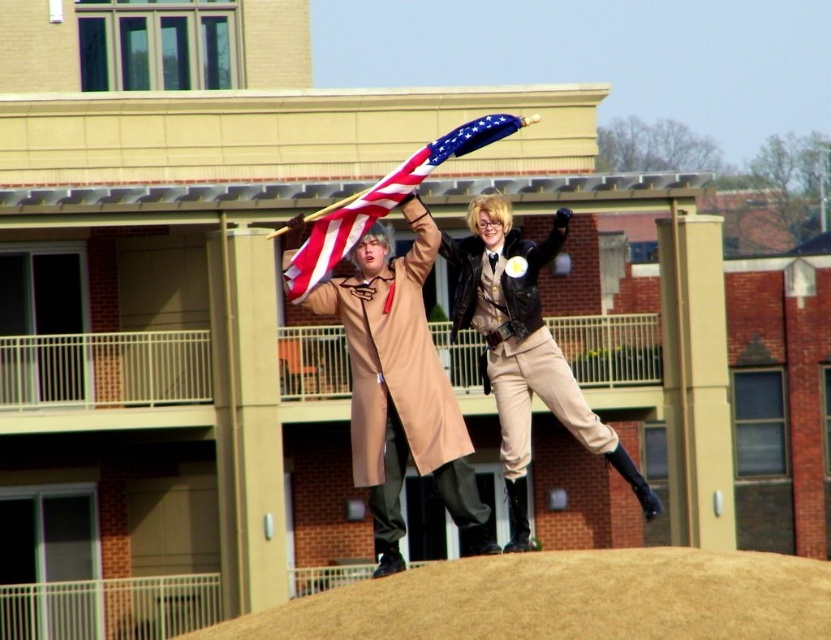
From the picture: You are a photographer positioned at the base of the building. You want to capture a shot where the american flag at center is clearly visible above the brown textured mound at lower center. Based on their positions, is this possible?

The brown textured mound at lower center is located below the american flag at center, so yes, the photographer can capture the american flag at center above the brown textured mound at lower center in the shot.